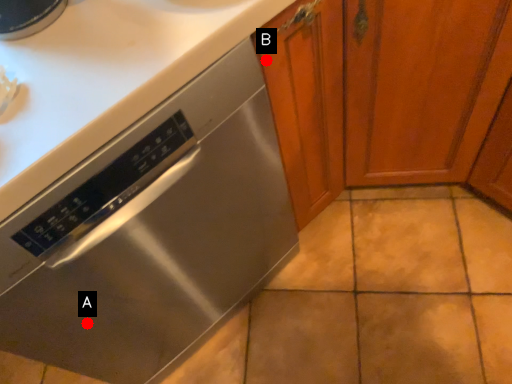
Question: Two points are circled on the image, labeled by A and B beside each circle. Among these points, which one is nearest to the camera?

Choices:
 (A) A is closer
 (B) B is closer

Answer: (B)